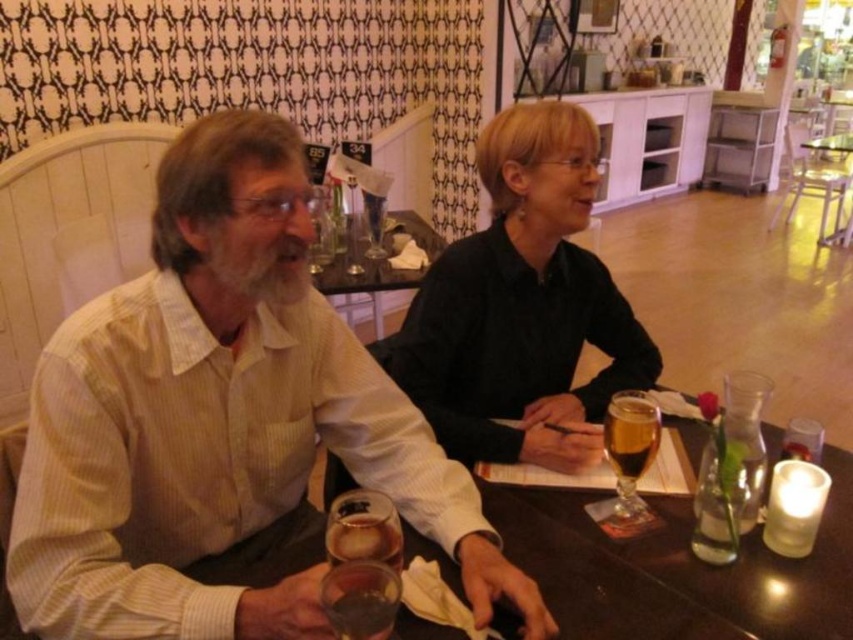
You are a barista trying to place a new drink order on the table. The drink is taller than the smooth wooden table at center. Can you safely place it there without it touching the amber glass beer at center?

The smooth wooden table at center is not as tall as the amber glass beer at center, so the new drink, which is taller than the table, would likely be taller than the existing beer. This might cause them to touch if placed too close, so caution is needed to ensure enough space between them.

You are a waiter in a restaurant. You need to place a 12 inch long platter between the white striped shirt at left and the translucent glass wine glass at center. Is there enough space?

The distance between the white striped shirt at left and the translucent glass wine glass at center is 10.10 inches. Since the platter is 12 inches long, it won with the available space.